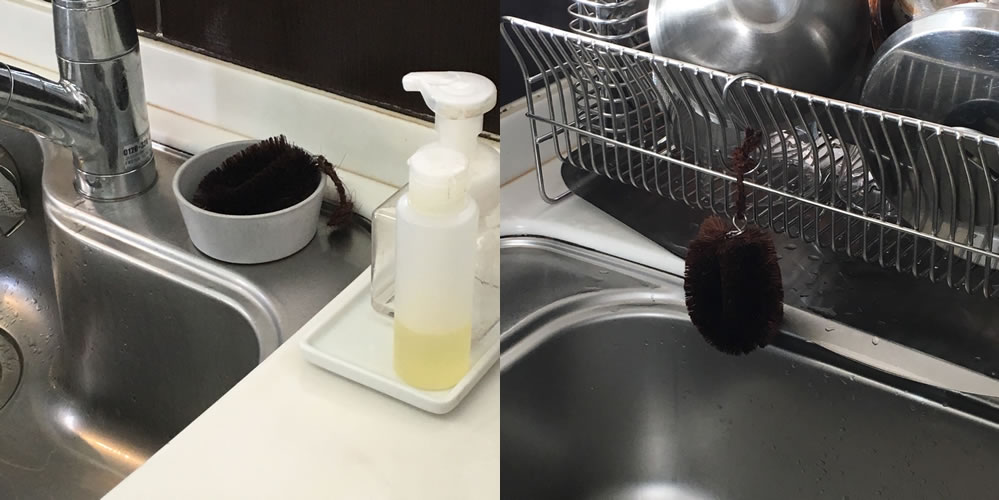
The height and width of the screenshot is (500, 999). Identify the location of cookware. (770, 49), (949, 77).